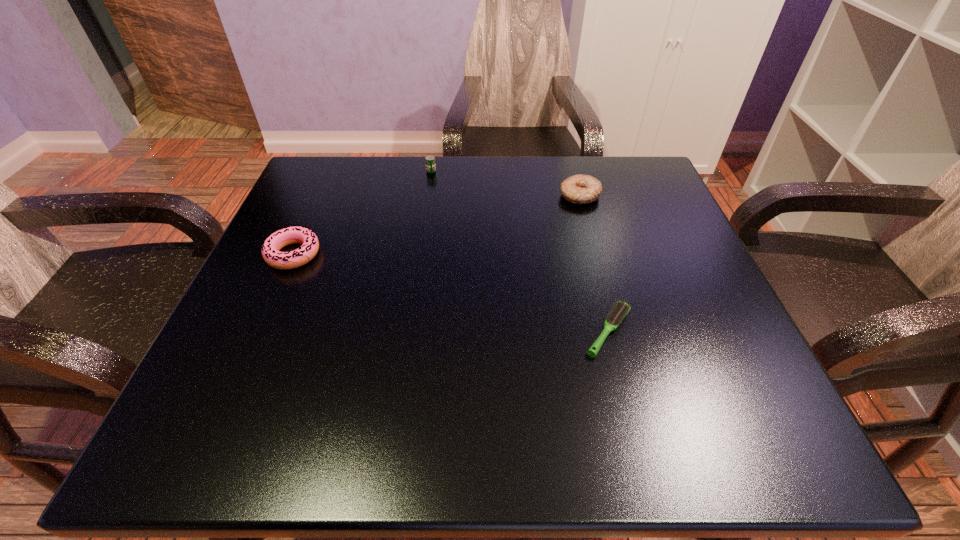
The height and width of the screenshot is (540, 960). I want to click on free spot located on the right of the second nearest object, so click(392, 254).

Where is `vacant space located on the left of the nearest object`? Image resolution: width=960 pixels, height=540 pixels. vacant space located on the left of the nearest object is located at coordinates (405, 331).

Where is `beer can situated at the far edge`? beer can situated at the far edge is located at coordinates (429, 160).

In order to click on doughnut at the far edge in this screenshot , I will do `click(578, 189)`.

Image resolution: width=960 pixels, height=540 pixels. Find the location of `object situated at the left edge`. object situated at the left edge is located at coordinates (271, 247).

Locate an element on the screen. object positioned at the right edge is located at coordinates (578, 189).

Identify the location of object located at the far right corner. The width and height of the screenshot is (960, 540). (578, 189).

Identify the location of vacant region at the far edge of the desktop. (438, 181).

Identify the location of free space at the near edge of the desktop. (396, 433).

Where is `vacant space at the left edge`? vacant space at the left edge is located at coordinates (295, 332).